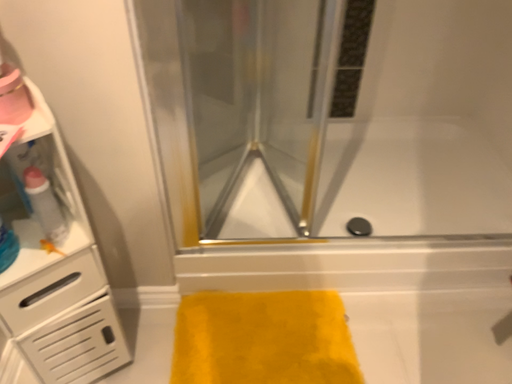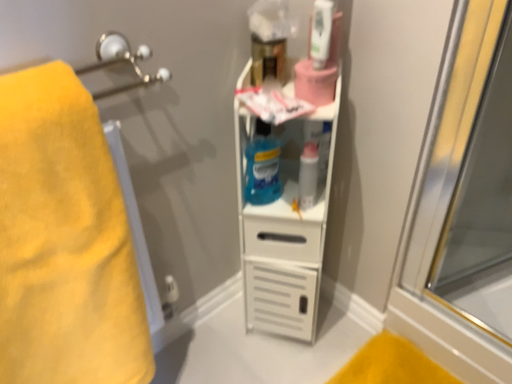
Question: Which way did the camera rotate in the video?

Choices:
 (A) rotated left
 (B) rotated right

Answer: (A)